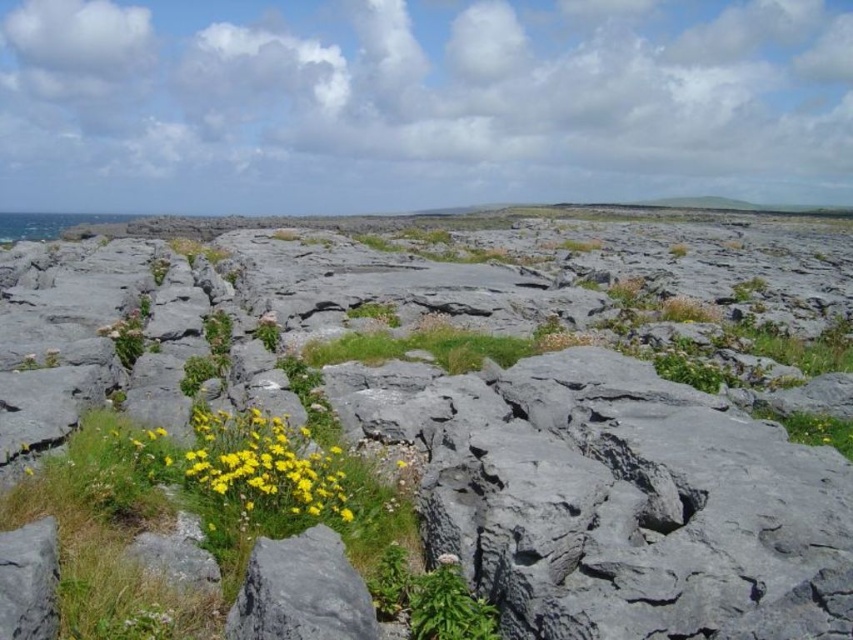
You are a hiker trying to cross the rocky terrain. You see two gray rough rocks in your path. The first is the gray rough rock at center, and the second is the gray rough rock at lower center. Which rock would you need to step over if you are approaching from the lower part of the image?

The gray rough rock at lower center is closer to you, so you would need to step over it first before reaching the gray rough rock at center.

You are a botanist examining the rocky landscape. You need to locate the yellow matte flower at lower left. What are the coordinates where you should look?

The yellow matte flower at lower left can be found at coordinates point (265, 465).

You are a photographer standing in the rugged, rocky landscape. You want to take a photo that includes both the point at coordinates point (x=280, y=509) and point (x=254, y=586). Which point should you focus on first to ensure both are in sharp focus?

You should focus on point (x=280, y=509) first because it is closer to the camera than point (x=254, y=586). By focusing on the closer point, the farther point will also be within the depth of field and in sharp focus.